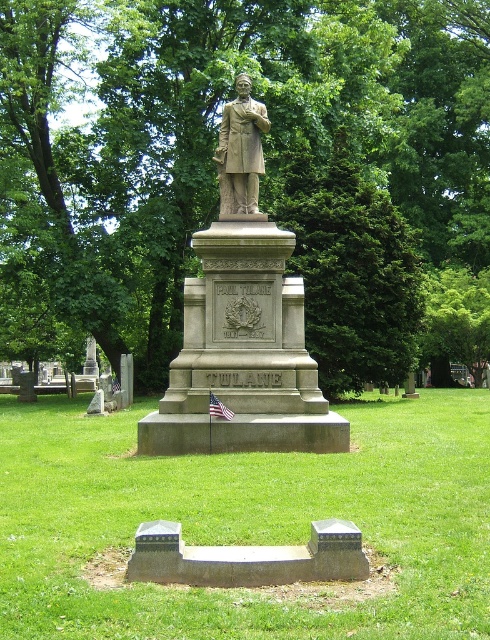
Question: Which of these objects is positioned closest to the gray stone statue at center?

Choices:
 (A) green leafy tree at center
 (B) smooth concrete bench at center

Answer: (B)

Question: Observing the image, what is the correct spatial positioning of gray stone statue at center in reference to bronze statue at center?

Choices:
 (A) above
 (B) below

Answer: (B)

Question: Does smooth concrete bench at center appear on the left side of gray stone statue at center?

Choices:
 (A) yes
 (B) no

Answer: (B)

Question: Which is farther from the gray stone statue at center?

Choices:
 (A) green leafy tree at center
 (B) bronze statue at center

Answer: (A)

Question: Does green leafy tree at center have a lesser width compared to smooth concrete bench at center?

Choices:
 (A) no
 (B) yes

Answer: (A)

Question: Among these points, which one is farthest from the camera?

Choices:
 (A) (241, 138)
 (B) (51, 467)
 (C) (296, 113)

Answer: (C)